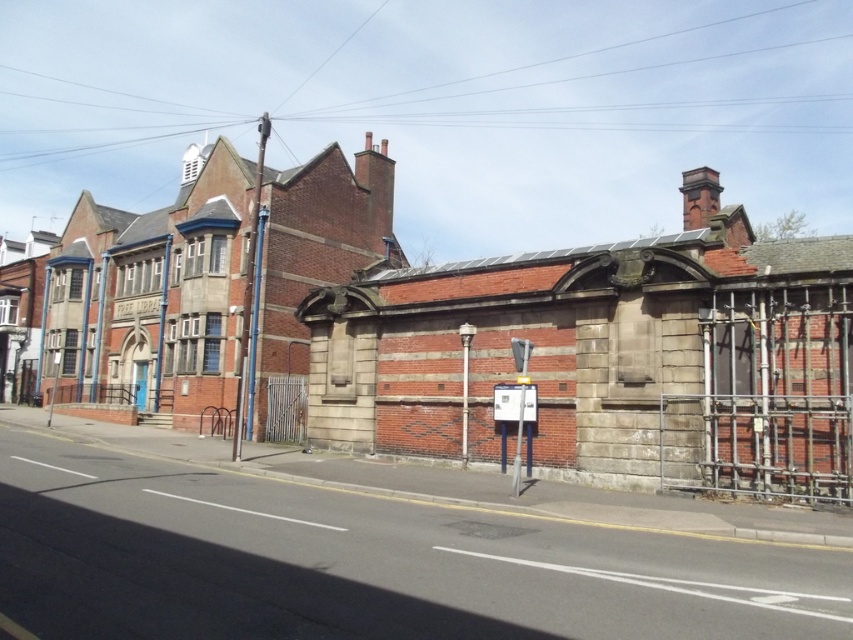
Question: Is metallic scaffolding at right behind metallic gray sign at center?

Choices:
 (A) no
 (B) yes

Answer: (A)

Question: Which point is closer to the camera?

Choices:
 (A) metallic scaffolding at right
 (B) metallic gray sign at center

Answer: (A)

Question: Is metallic scaffolding at right below metallic gray sign at center?

Choices:
 (A) no
 (B) yes

Answer: (B)

Question: Does metallic scaffolding at right appear over metallic gray sign at center?

Choices:
 (A) no
 (B) yes

Answer: (A)

Question: Which of the following is the closest to the observer?

Choices:
 (A) (740, 330)
 (B) (524, 364)

Answer: (B)